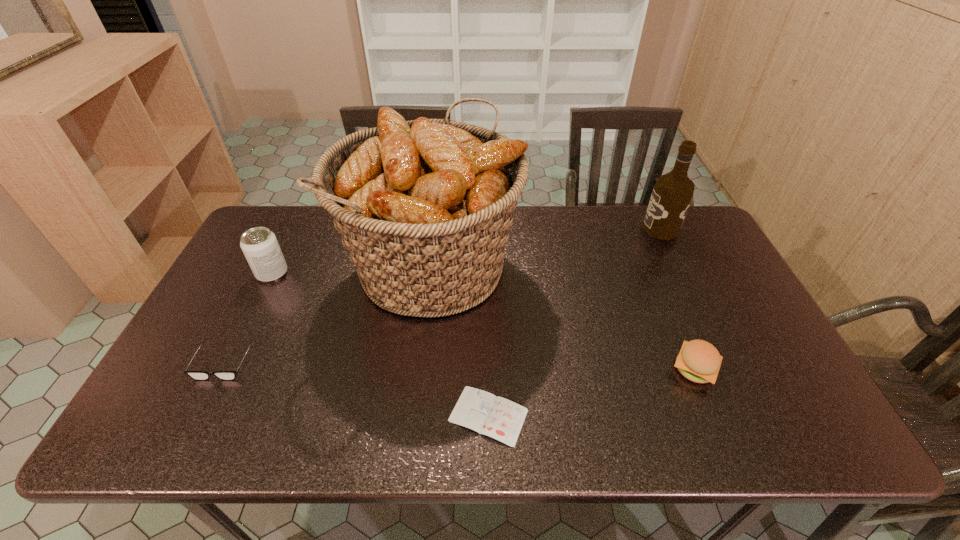
You are a GUI agent. You are given a task and a screenshot of the screen. Output one action in this format:
    pyautogui.click(x=<x>, y=<y>)
    Task: Click on the object located in the far right corner section of the desktop
    
    Given the screenshot: What is the action you would take?
    pyautogui.click(x=672, y=193)

Image resolution: width=960 pixels, height=540 pixels. Find the location of `vacant space at the far edge`. vacant space at the far edge is located at coordinates (609, 221).

Identify the location of vacant space at the near edge. (407, 438).

The width and height of the screenshot is (960, 540). What are the coordinates of `free space at the left edge of the desktop` in the screenshot? It's located at [234, 288].

Find the location of a particular element. The height and width of the screenshot is (540, 960). free space at the right edge is located at coordinates (713, 266).

Where is `vacant space at the near right corner of the desktop`? Image resolution: width=960 pixels, height=540 pixels. vacant space at the near right corner of the desktop is located at coordinates (776, 426).

Locate an element on the screen. This screenshot has height=540, width=960. free space between the tallest object and the third shortest object is located at coordinates (564, 316).

I want to click on free spot between the tallest object and the soda can, so click(352, 269).

Find the location of a particular element. The image size is (960, 540). vacant space that's between the diary and the spectacles is located at coordinates (356, 389).

Find the location of a particular element. vacant space in between the alcohol and the basket is located at coordinates click(546, 247).